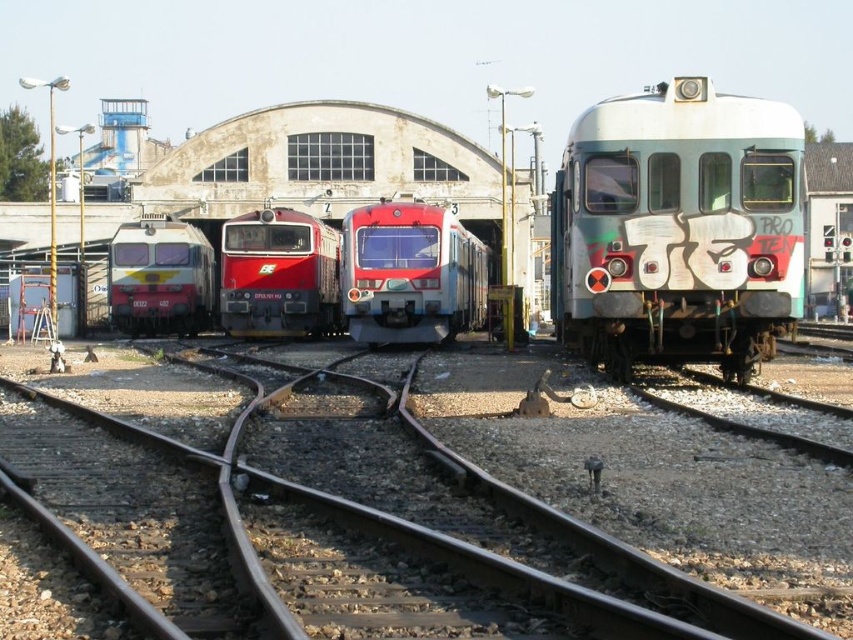
Question: Considering the relative positions of metal at center and smooth red train at center in the image provided, where is metal at center located with respect to smooth red train at center?

Choices:
 (A) below
 (B) above

Answer: (A)

Question: Among these points, which one is farthest from the camera?

Choices:
 (A) (28, 353)
 (B) (683, 252)

Answer: (A)

Question: Which of the following is the farthest from the observer?

Choices:
 (A) (192, 442)
 (B) (167, 264)
 (C) (415, 278)

Answer: (B)

Question: Is metal at center bigger than matte red train at center?

Choices:
 (A) no
 (B) yes

Answer: (A)

Question: Considering the relative positions of smooth red train at center and brushed metal train at left in the image provided, where is smooth red train at center located with respect to brushed metal train at left?

Choices:
 (A) left
 (B) right

Answer: (B)

Question: Which point is closer to the camera?

Choices:
 (A) (329, 256)
 (B) (746, 208)
 (C) (215, 326)

Answer: (B)